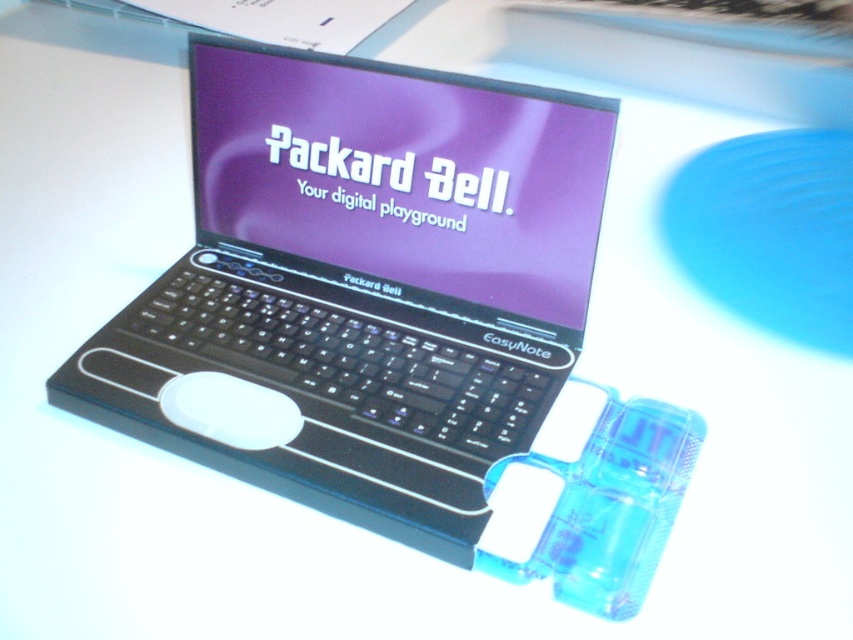
Who is lower down, black plastic laptop at center or white matte mouse at center?

Positioned lower is white matte mouse at center.

Between black plastic laptop at center and white matte mouse at center, which one is positioned higher?

black plastic laptop at center is above.

This screenshot has width=853, height=640. Describe the element at coordinates (367, 280) in the screenshot. I see `black plastic laptop at center` at that location.

At what (x,y) coordinates should I click in order to perform the action: click on black plastic laptop at center. Please return your answer as a coordinate pair (x, y). The height and width of the screenshot is (640, 853). Looking at the image, I should click on (367, 280).